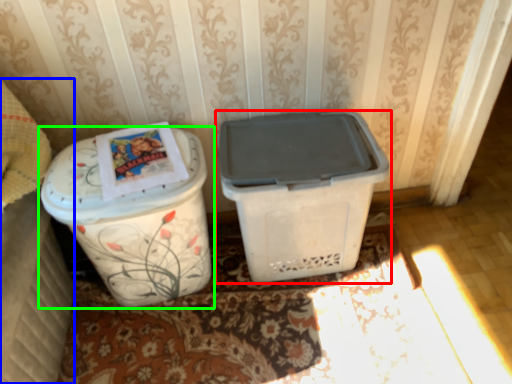
Question: Estimate the real-world distances between objects in this image. Which object is closer to waste container (highlighted by a red box), leftover (highlighted by a blue box) or waste container (highlighted by a green box)?

Choices:
 (A) leftover
 (B) waste container

Answer: (B)